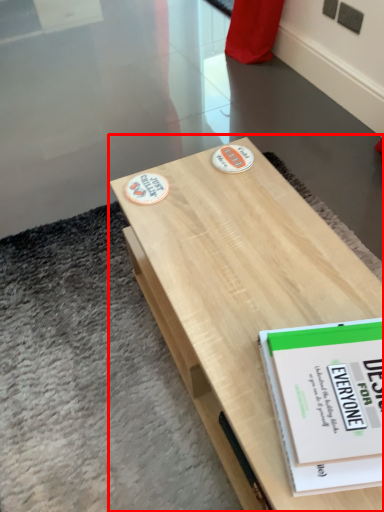
Question: From the image, what is the correct spatial relationship of table (annotated by the red box) in relation to book?

Choices:
 (A) right
 (B) left

Answer: (B)